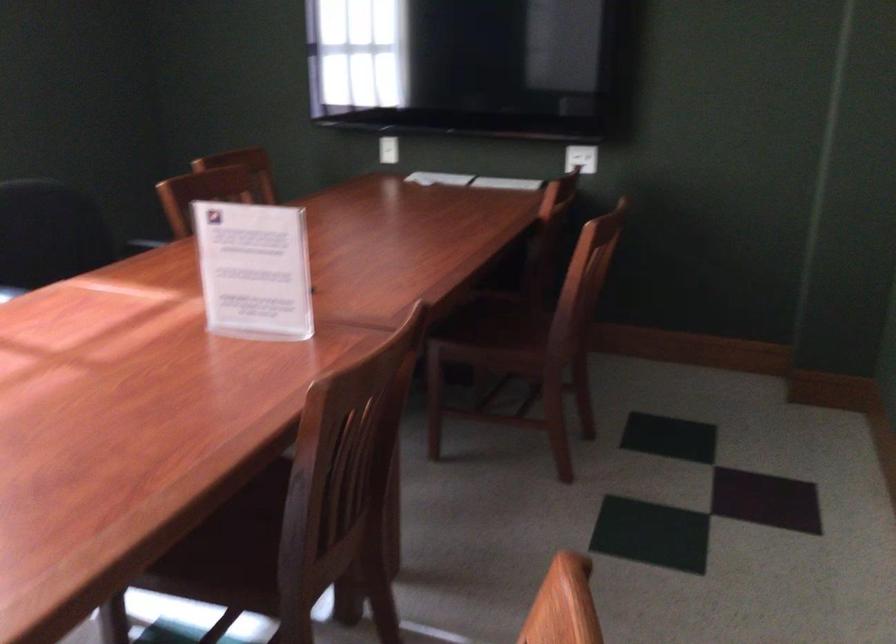
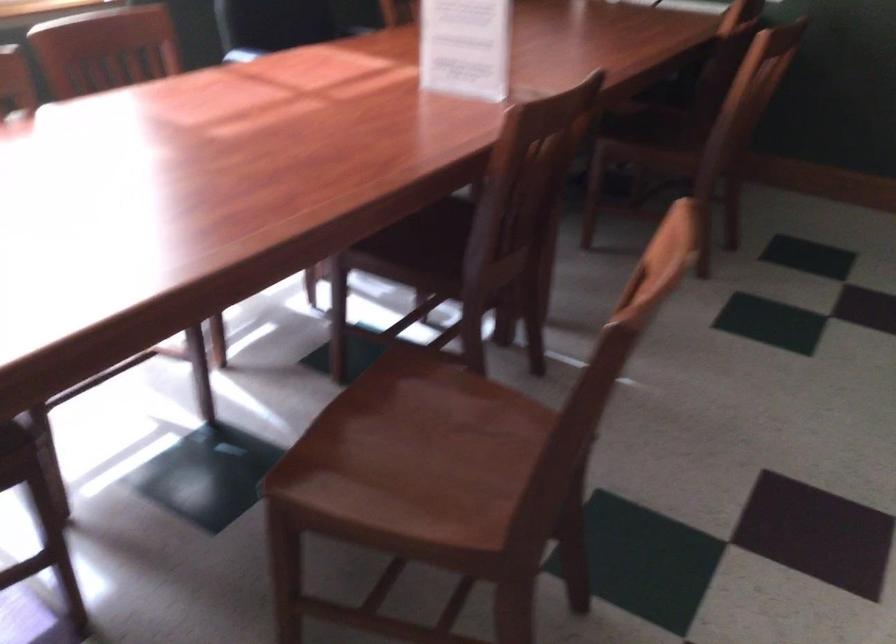
Question: What movement of the cameraman would produce the second image?

Choices:
 (A) Left
 (B) Right
 (C) Forward
 (D) Backward

Answer: (D)